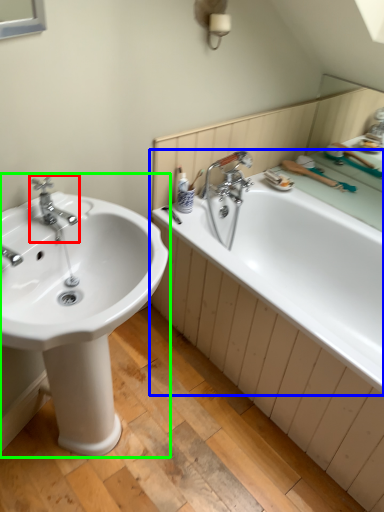
Question: Which object is the closest to the tap (highlighted by a red box)? Choose among these: bathtub (highlighted by a blue box) or sink (highlighted by a green box).

Choices:
 (A) bathtub
 (B) sink

Answer: (B)